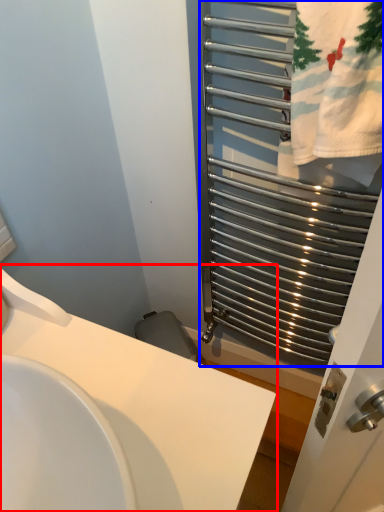
Question: Which of the following is the closest to the observer, sink (highlighted by a red box) or cage (highlighted by a blue box)?

Choices:
 (A) sink
 (B) cage

Answer: (A)